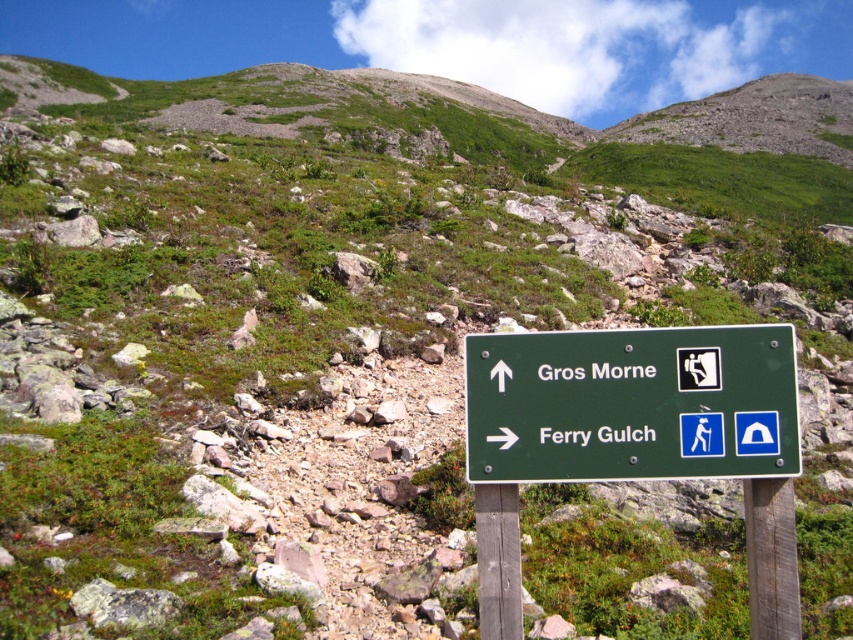
Does green wooden signpost at center appear on the right side of brown wooden pole at center?

In fact, green wooden signpost at center is to the left of brown wooden pole at center.

I want to click on green wooden signpost at center, so click(635, 440).

Is green wooden signpost at center positioned at the back of brown wooden post at center?

No, green wooden signpost at center is in front of brown wooden post at center.

The width and height of the screenshot is (853, 640). What do you see at coordinates (635, 440) in the screenshot?
I see `green wooden signpost at center` at bounding box center [635, 440].

The height and width of the screenshot is (640, 853). What are the coordinates of `green wooden signpost at center` in the screenshot? It's located at (635, 440).

What do you see at coordinates (631, 404) in the screenshot?
I see `green plastic sign at center` at bounding box center [631, 404].

Who is more forward, (532, 428) or (764, 563)?

Point (764, 563)

Which is behind, point (467, 444) or point (785, 625)?

The point (467, 444) is more distant.

I want to click on green plastic sign at center, so click(631, 404).